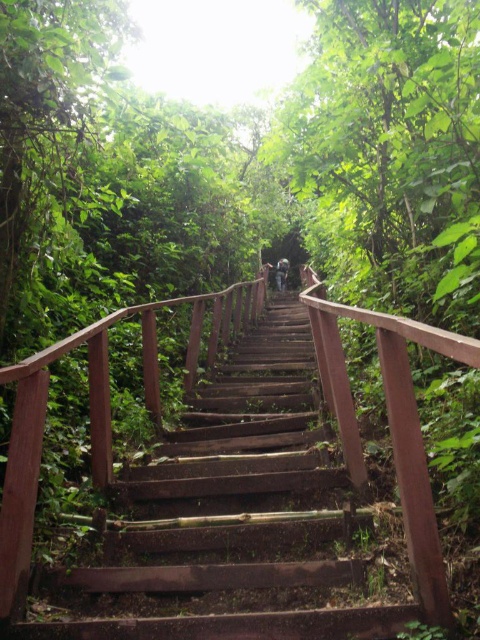
Question: Does wooden stairs at center appear under light brown wooden stairs at center?

Choices:
 (A) yes
 (B) no

Answer: (A)

Question: Which point appears closest to the camera in this image?

Choices:
 (A) (300, 403)
 (B) (279, 278)

Answer: (A)

Question: Is wooden stairs at center positioned before light brown wooden stairs at center?

Choices:
 (A) no
 (B) yes

Answer: (B)

Question: Which point is farther to the camera?

Choices:
 (A) wooden stairs at center
 (B) light brown wooden stairs at center

Answer: (B)

Question: Among these points, which one is farthest from the camera?

Choices:
 (A) (277, 262)
 (B) (149, 486)

Answer: (A)

Question: In this image, where is wooden stairs at center located relative to light brown wooden stairs at center?

Choices:
 (A) below
 (B) above

Answer: (A)